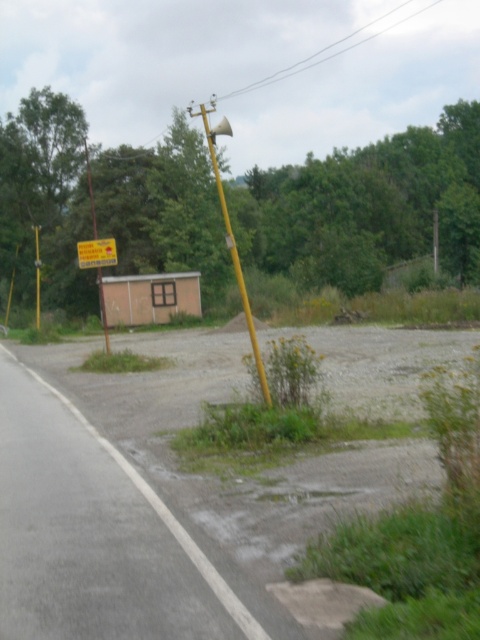
Question: Which point is farther from the camera taking this photo?

Choices:
 (A) (227, 124)
 (B) (96, 248)

Answer: (A)

Question: Which is nearer to the yellow matte sign at left?

Choices:
 (A) yellow matte pole at center
 (B) yellow plastic sign at center

Answer: (B)

Question: Is yellow matte pole at center positioned in front of yellow matte sign at left?

Choices:
 (A) yes
 (B) no

Answer: (A)

Question: Among these objects, which one is nearest to the camera?

Choices:
 (A) yellow matte sign at left
 (B) yellow matte pole at center
 (C) yellow plastic sign at center

Answer: (B)

Question: Is yellow plastic sign at center below yellow matte sign at left?

Choices:
 (A) yes
 (B) no

Answer: (A)

Question: Can you confirm if yellow matte pole at center is positioned to the right of yellow plastic sign at center?

Choices:
 (A) yes
 (B) no

Answer: (A)